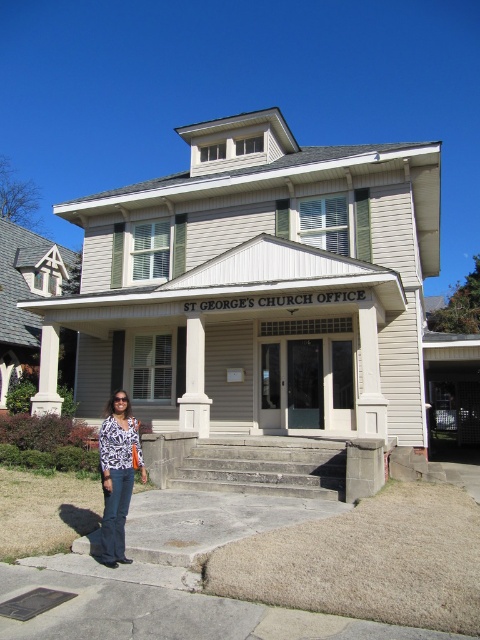
Question: Which object is closer to the camera taking this photo?

Choices:
 (A) printed fabric blouse at lower left
 (B) gray concrete stairs at center

Answer: (A)

Question: Which of the following is the closest to the observer?

Choices:
 (A) (303, 483)
 (B) (109, 424)

Answer: (B)

Question: Which object is farther from the camera taking this photo?

Choices:
 (A) printed fabric blouse at lower left
 (B) gray concrete stairs at center

Answer: (B)

Question: Does gray concrete stairs at center appear under printed fabric blouse at lower left?

Choices:
 (A) no
 (B) yes

Answer: (B)

Question: Is printed fabric blouse at lower left bigger than white smooth column at left?

Choices:
 (A) yes
 (B) no

Answer: (B)

Question: Can you confirm if gray concrete stairs at center is positioned above printed fabric blouse at lower left?

Choices:
 (A) no
 (B) yes

Answer: (A)